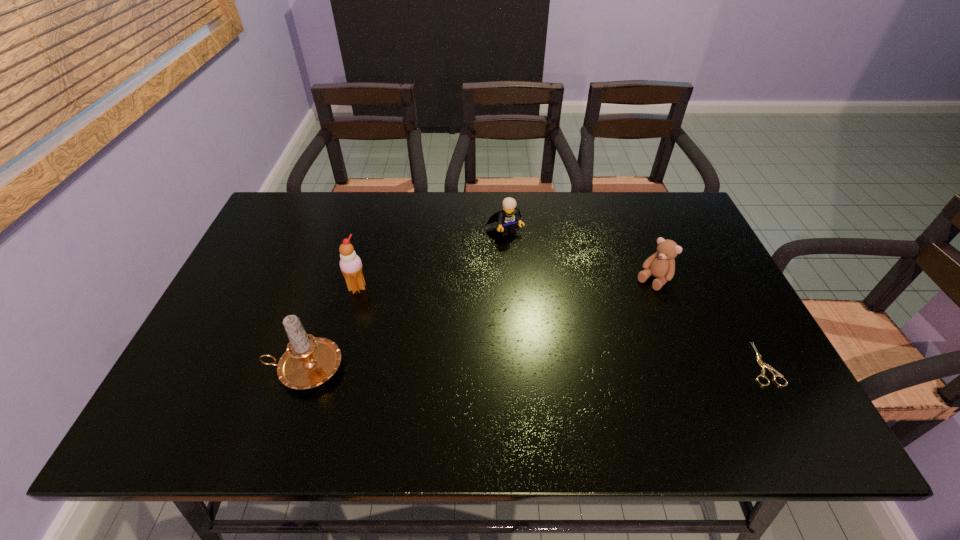
This screenshot has height=540, width=960. I want to click on shears at the near edge, so click(x=760, y=362).

This screenshot has height=540, width=960. What are the coordinates of `shears that is at the right edge` in the screenshot? It's located at (760, 362).

Find the location of `teddy bear that is at the right edge`. teddy bear that is at the right edge is located at coordinates (661, 265).

The image size is (960, 540). I want to click on object positioned at the near right corner, so click(760, 362).

In order to click on vacant area at the far edge of the desktop in this screenshot , I will do 378,236.

At what (x,y) coordinates should I click in order to perform the action: click on vacant space at the near edge of the desktop. Please return your answer as a coordinate pair (x, y). The height and width of the screenshot is (540, 960). Looking at the image, I should click on (695, 375).

In the image, there is a desktop. What are the coordinates of `free space at the left edge` in the screenshot? It's located at (263, 316).

Identify the location of free spot at the right edge of the desktop. The image size is (960, 540). (x=689, y=332).

Identify the location of free space at the far left corner. Image resolution: width=960 pixels, height=540 pixels. (295, 231).

At what (x,y) coordinates should I click in order to perform the action: click on blank space at the far right corner. Please return your answer as a coordinate pair (x, y). The image size is (960, 540). Looking at the image, I should click on (678, 212).